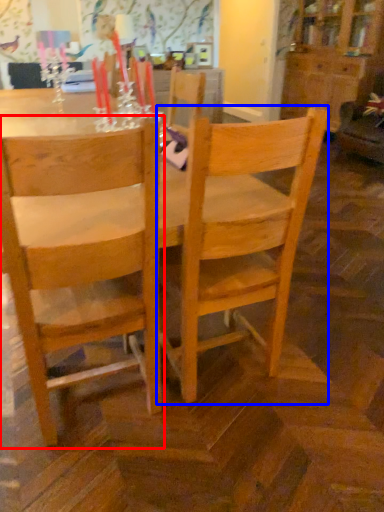
Question: Which object appears farthest to the camera in this image, chair (highlighted by a red box) or chair (highlighted by a blue box)?

Choices:
 (A) chair
 (B) chair

Answer: (B)